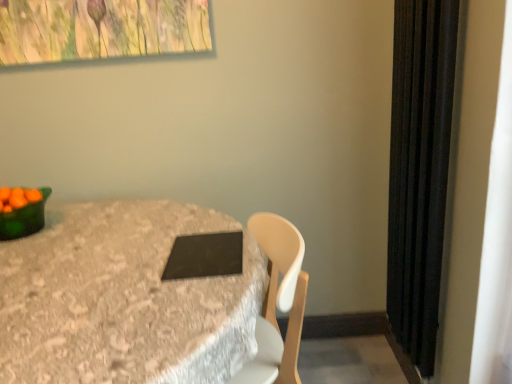
You are a GUI agent. You are given a task and a screenshot of the screen. Output one action in this format:
    pyautogui.click(x=<x>, y=<y>)
    Task: Click on the blank space to the left of black matte pad at center
    
    Given the screenshot: What is the action you would take?
    pyautogui.click(x=153, y=253)